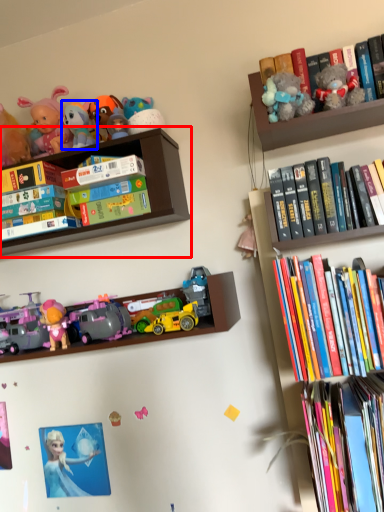
Question: Among these objects, which one is farthest to the camera, shelf (highlighted by a red box) or toy (highlighted by a blue box)?

Choices:
 (A) shelf
 (B) toy

Answer: (B)